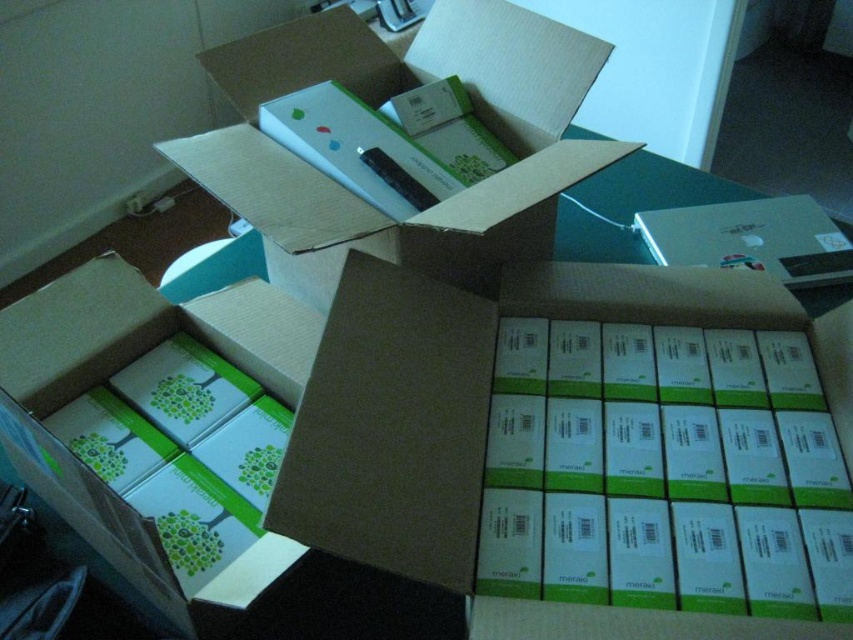
Question: Among these points, which one is nearest to the camera?

Choices:
 (A) (496, 28)
 (B) (293, 328)
 (C) (653, 428)

Answer: (C)

Question: Can you confirm if white cardboard box at upper center is bigger than white matte box at center?

Choices:
 (A) no
 (B) yes

Answer: (B)

Question: Which point appears closest to the camera in this image?

Choices:
 (A) (347, 228)
 (B) (445, 525)

Answer: (B)

Question: Does white matte cardboard box at center have a lesser width compared to white matte box at center?

Choices:
 (A) yes
 (B) no

Answer: (B)

Question: Where is white matte cardboard box at center located in relation to white cardboard box at upper center in the image?

Choices:
 (A) left
 (B) right

Answer: (B)

Question: Among these points, which one is farthest from the camera?

Choices:
 (A) (548, 241)
 (B) (257, 472)
 (C) (355, 364)

Answer: (A)